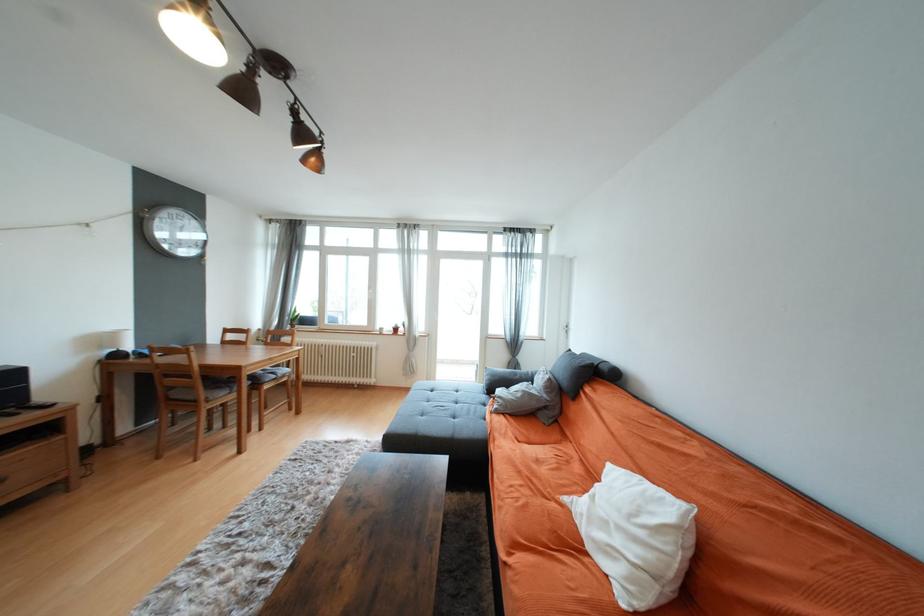
Locate an element on the screen. This screenshot has width=924, height=616. white pillow is located at coordinates (636, 536).